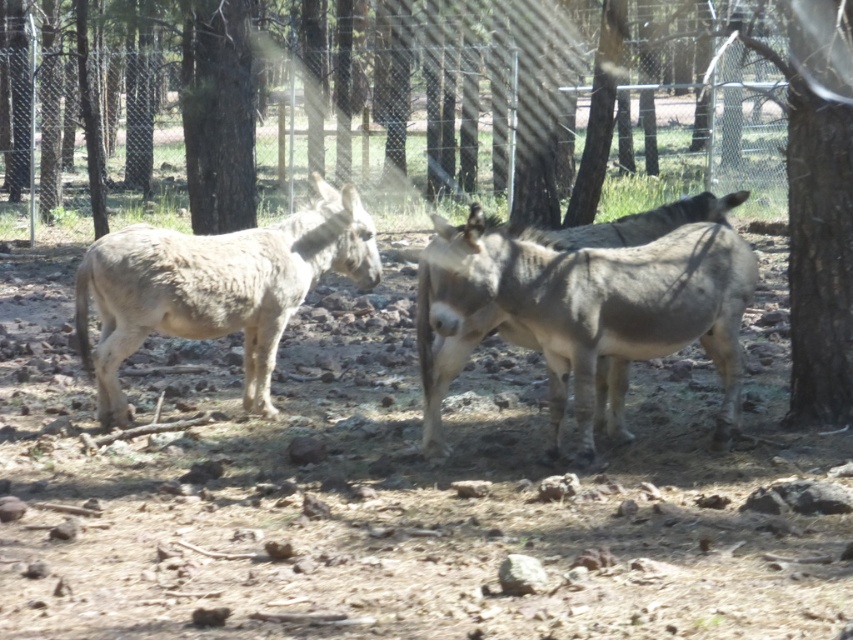
Which is more to the right, gray rough fur mule at center or brown rough bark tree at right?

brown rough bark tree at right is more to the right.

Does point (437, 388) come behind point (811, 328)?

No, (437, 388) is closer to viewer.

Is point (467, 266) less distant than point (799, 282)?

That is True.

You are a GUI agent. You are given a task and a screenshot of the screen. Output one action in this format:
    pyautogui.click(x=<x>, y=<y>)
    Task: Click on the gray rough fur mule at center
    This screenshot has height=640, width=853.
    Given the screenshot: What is the action you would take?
    pyautogui.click(x=579, y=308)

Does brown dirt field at center have a lesser width compared to brown rough bark tree at right?

No, brown dirt field at center is not thinner than brown rough bark tree at right.

Measure the distance from brown dirt field at center to brown rough bark tree at right.

brown dirt field at center and brown rough bark tree at right are 2.56 meters apart from each other.

Between point (560, 596) and point (849, 342), which one is positioned behind?

Positioned behind is point (849, 342).

At what (x,y) coordinates should I click in order to perform the action: click on brown dirt field at center. Please return your answer as a coordinate pair (x, y). Looking at the image, I should click on (402, 493).

Looking at this image, which is more to the left, brown dirt field at center or fuzzy gray mule at center?

From the viewer's perspective, fuzzy gray mule at center appears more on the left side.

In the scene shown: Does brown dirt field at center have a larger size compared to fuzzy gray mule at center?

No, brown dirt field at center is not bigger than fuzzy gray mule at center.

Does point (616, 547) come in front of point (143, 284)?

Yes, it is in front of point (143, 284).

The image size is (853, 640). I want to click on brown dirt field at center, so click(402, 493).